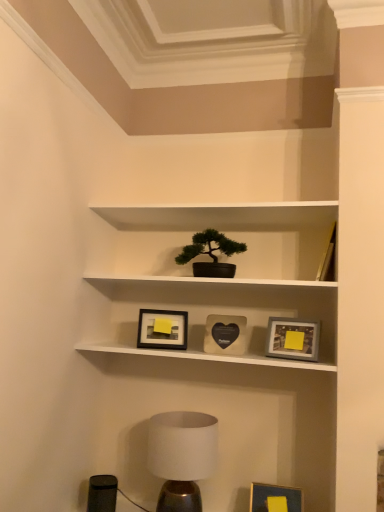
In order to face matte black heart-shaped picture frame at center, the 3th picture frame in the right-to-left sequence, should I rotate leftwards or rightwards?

Turn right by 4.226 degrees to look at matte black heart-shaped picture frame at center, the 3th picture frame in the right-to-left sequence.

Image resolution: width=384 pixels, height=512 pixels. Describe the element at coordinates (225, 334) in the screenshot. I see `matte black heart-shaped picture frame at center, which is the 4th picture frame from bottom to top` at that location.

Measure the distance between point (177,256) and camera.

Point (177,256) and camera are 2.15 meters apart from each other.

Locate an element on the screen. Image resolution: width=384 pixels, height=512 pixels. white matte table lamp at lower center is located at coordinates (181, 457).

I want to click on matte gray picture frame at center right, placed as the 4th picture frame when sorted from left to right, so click(x=292, y=339).

Image resolution: width=384 pixels, height=512 pixels. I want to click on white matte shelf at center, so click(x=215, y=279).

Describe the element at coordinates (161, 329) in the screenshot. I see `matte black picture frame at center, positioned as the second picture frame in top-to-bottom order` at that location.

Image resolution: width=384 pixels, height=512 pixels. I want to click on matte black heart-shaped picture frame at center, which is the 4th picture frame from bottom to top, so click(225, 334).

Is matte black picture frame at center, acting as the 4th picture frame starting from the right, facing away from green matte houseplant at upper center?

No, matte black picture frame at center, acting as the 4th picture frame starting from the right, is not facing the opposite direction of green matte houseplant at upper center.

From the image's perspective, is matte black picture frame at center, which ranks as the 3th picture frame in bottom-to-top order, below green matte houseplant at upper center?

Correct, matte black picture frame at center, which ranks as the 3th picture frame in bottom-to-top order, appears lower than green matte houseplant at upper center in the image.

From a real-world perspective, is matte black picture frame at center, acting as the 4th picture frame starting from the right, physically above green matte houseplant at upper center?

No, from a real-world perspective, matte black picture frame at center, acting as the 4th picture frame starting from the right, is not above green matte houseplant at upper center.

Is matte blue picture frame at lower right, the 1th picture frame in the bottom-to-top sequence, closer to the viewer compared to green matte houseplant at upper center?

Yes, matte blue picture frame at lower right, the 1th picture frame in the bottom-to-top sequence, is in front of green matte houseplant at upper center.

From a real-world perspective, does matte blue picture frame at lower right, which ranks as the 3th picture frame in left-to-right order, sit lower than green matte houseplant at upper center?

Yes, from a real-world perspective, matte blue picture frame at lower right, which ranks as the 3th picture frame in left-to-right order, is beneath green matte houseplant at upper center.

Does matte blue picture frame at lower right, which ranks as the 3th picture frame in left-to-right order, have a greater width compared to green matte houseplant at upper center?

No.

Can you confirm if matte black heart-shaped picture frame at center, which is counted as the second picture frame, starting from the left, is positioned to the right of matte black picture frame at center, which ranks as the 3th picture frame in bottom-to-top order?

Yes, matte black heart-shaped picture frame at center, which is counted as the second picture frame, starting from the left, is to the right of matte black picture frame at center, which ranks as the 3th picture frame in bottom-to-top order.

Looking at this image, would you say matte black heart-shaped picture frame at center, the 3th picture frame in the right-to-left sequence, is outside matte black picture frame at center, positioned as the second picture frame in top-to-bottom order?

matte black heart-shaped picture frame at center, the 3th picture frame in the right-to-left sequence, is positioned outside matte black picture frame at center, positioned as the second picture frame in top-to-bottom order.

How far apart are matte black heart-shaped picture frame at center, the first picture frame viewed from the top, and matte black picture frame at center, acting as the 4th picture frame starting from the right?

matte black heart-shaped picture frame at center, the first picture frame viewed from the top, is 8.05 inches from matte black picture frame at center, acting as the 4th picture frame starting from the right.

Can you confirm if matte black heart-shaped picture frame at center, the first picture frame viewed from the top, is bigger than matte black picture frame at center, acting as the 4th picture frame starting from the right?

Yes, matte black heart-shaped picture frame at center, the first picture frame viewed from the top, is bigger than matte black picture frame at center, acting as the 4th picture frame starting from the right.

Does white matte shelf at center turn towards white matte table lamp at lower center?

No, white matte shelf at center is not facing towards white matte table lamp at lower center.

From the picture: Considering the sizes of objects white matte shelf at center and white matte table lamp at lower center in the image provided, who is taller, white matte shelf at center or white matte table lamp at lower center?

white matte shelf at center is taller.

From a real-world perspective, relative to white matte table lamp at lower center, is white matte shelf at center vertically above or below?

Clearly, from a real-world perspective, white matte shelf at center is above white matte table lamp at lower center.

Which is behind, white matte shelf at center or white matte table lamp at lower center?

white matte shelf at center is further from the camera.

Are matte black heart-shaped picture frame at center, which is the 4th picture frame from bottom to top, and white matte shelf at center beside each other?

matte black heart-shaped picture frame at center, which is the 4th picture frame from bottom to top, and white matte shelf at center are clearly separated.

Is point (219, 350) positioned after point (130, 257)?

No, it is in front of (130, 257).

Does matte black heart-shaped picture frame at center, the 3th picture frame in the right-to-left sequence, have a greater height compared to white matte shelf at center?

No, matte black heart-shaped picture frame at center, the 3th picture frame in the right-to-left sequence, is not taller than white matte shelf at center.

Can you tell me how much matte blue picture frame at lower right, which ranks as the 3th picture frame in left-to-right order, and matte black heart-shaped picture frame at center, which is counted as the second picture frame, starting from the left, differ in facing direction?

0.000647 degrees separate the facing orientations of matte blue picture frame at lower right, which ranks as the 3th picture frame in left-to-right order, and matte black heart-shaped picture frame at center, which is counted as the second picture frame, starting from the left.

Is matte blue picture frame at lower right, acting as the 4th picture frame starting from the top, to the left of matte black heart-shaped picture frame at center, which is the 4th picture frame from bottom to top, from the viewer's perspective?

Incorrect, matte blue picture frame at lower right, acting as the 4th picture frame starting from the top, is not on the left side of matte black heart-shaped picture frame at center, which is the 4th picture frame from bottom to top.

From the image's perspective, between matte blue picture frame at lower right, the second picture frame viewed from the right, and matte black heart-shaped picture frame at center, which is counted as the second picture frame, starting from the left, which one is located above?

matte black heart-shaped picture frame at center, which is counted as the second picture frame, starting from the left, is shown above in the image.

From their relative heights in the image, would you say white matte table lamp at lower center is taller or shorter than green matte houseplant at upper center?

In the image, white matte table lamp at lower center appears to be taller than green matte houseplant at upper center.

Which is in front, point (185, 435) or point (227, 263)?

Point (185, 435)

Considering the sizes of objects white matte table lamp at lower center and green matte houseplant at upper center in the image provided, who is wider, white matte table lamp at lower center or green matte houseplant at upper center?

With larger width is white matte table lamp at lower center.

The height and width of the screenshot is (512, 384). In order to click on houseplant in front of the matte black picture frame at center, which ranks as the 3th picture frame in bottom-to-top order in this screenshot , I will do `click(211, 254)`.

This screenshot has width=384, height=512. I want to click on houseplant that is on the left side of matte blue picture frame at lower right, the second picture frame viewed from the right, so click(211, 254).

Based on their spatial positions, is white matte table lamp at lower center or matte black heart-shaped picture frame at center, which is the 4th picture frame from bottom to top, further from matte blue picture frame at lower right, which ranks as the 3th picture frame in left-to-right order?

The object further to matte blue picture frame at lower right, which ranks as the 3th picture frame in left-to-right order, is matte black heart-shaped picture frame at center, which is the 4th picture frame from bottom to top.

Which object lies further to the anchor point matte black heart-shaped picture frame at center, which is the 4th picture frame from bottom to top, green matte houseplant at upper center or matte black picture frame at center, acting as the 4th picture frame starting from the right?

green matte houseplant at upper center.

Looking at the image, which one is located further to white matte shelf at center, matte black picture frame at center, positioned as the second picture frame in top-to-bottom order, or matte black heart-shaped picture frame at center, which is the 4th picture frame from bottom to top?

matte black picture frame at center, positioned as the second picture frame in top-to-bottom order, lies further to white matte shelf at center than the other object.

Looking at the image, which one is located further to matte gray picture frame at center right, placed as the 4th picture frame when sorted from left to right, matte blue picture frame at lower right, which ranks as the 3th picture frame in left-to-right order, or matte black picture frame at center, positioned as the second picture frame in top-to-bottom order?

The object further to matte gray picture frame at center right, placed as the 4th picture frame when sorted from left to right, is matte blue picture frame at lower right, which ranks as the 3th picture frame in left-to-right order.

Based on their spatial positions, is matte gray picture frame at center right, placed as the 4th picture frame when sorted from left to right, or white matte shelf at center further from green matte houseplant at upper center?

Among the two, matte gray picture frame at center right, placed as the 4th picture frame when sorted from left to right, is located further to green matte houseplant at upper center.

When comparing their distances from green matte houseplant at upper center, does matte black heart-shaped picture frame at center, the first picture frame viewed from the top, or matte gray picture frame at center right, the 1th picture frame positioned from the right, seem closer?

Based on the image, matte black heart-shaped picture frame at center, the first picture frame viewed from the top, appears to be nearer to green matte houseplant at upper center.

Considering their positions, is white matte shelf at center positioned closer to green matte houseplant at upper center than matte black picture frame at center, acting as the 4th picture frame starting from the right?

The object closer to green matte houseplant at upper center is white matte shelf at center.

Which object lies further to the anchor point white matte shelf at center, matte blue picture frame at lower right, the 1th picture frame in the bottom-to-top sequence, or matte black picture frame at center, acting as the 1th picture frame starting from the left?

Based on the image, matte blue picture frame at lower right, the 1th picture frame in the bottom-to-top sequence, appears to be further to white matte shelf at center.

You are a GUI agent. You are given a task and a screenshot of the screen. Output one action in this format:
    pyautogui.click(x=<x>, y=<y>)
    Task: Click on the shelf situated between matte black picture frame at center, positioned as the second picture frame in top-to-bottom order, and matte gray picture frame at center right, the 1th picture frame positioned from the right, from left to right
    This screenshot has width=384, height=512.
    Given the screenshot: What is the action you would take?
    pyautogui.click(x=215, y=279)

Locate an element on the screen. The width and height of the screenshot is (384, 512). shelf between green matte houseplant at upper center and white matte table lamp at lower center in the up-down direction is located at coordinates (215, 279).

Where is `table lamp that lies between white matte shelf at center and matte blue picture frame at lower right, the second picture frame viewed from the right, from top to bottom`? The height and width of the screenshot is (512, 384). table lamp that lies between white matte shelf at center and matte blue picture frame at lower right, the second picture frame viewed from the right, from top to bottom is located at coordinates (181, 457).

Image resolution: width=384 pixels, height=512 pixels. In order to click on table lamp between green matte houseplant at upper center and matte blue picture frame at lower right, which ranks as the 3th picture frame in left-to-right order, from top to bottom in this screenshot , I will do `click(181, 457)`.